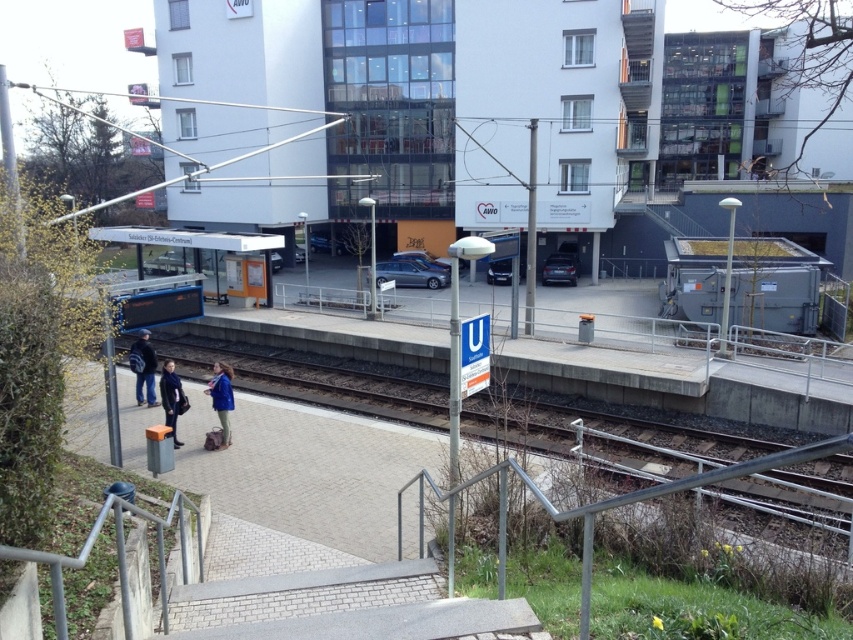
How far apart are blue fabric coat at center and dark blue leather jacket at lower left?

blue fabric coat at center is 26.24 inches away from dark blue leather jacket at lower left.

I want to click on blue fabric coat at center, so click(221, 397).

This screenshot has height=640, width=853. I want to click on blue fabric coat at center, so (x=221, y=397).

Who is shorter, dark blue jacket at center or blue fabric coat at center?

blue fabric coat at center

Can you confirm if dark blue jacket at center is positioned below blue fabric coat at center?

Incorrect, dark blue jacket at center is not positioned below blue fabric coat at center.

The height and width of the screenshot is (640, 853). What do you see at coordinates (143, 369) in the screenshot?
I see `dark blue jacket at center` at bounding box center [143, 369].

Locate an element on the screen. This screenshot has width=853, height=640. dark blue jacket at center is located at coordinates (143, 369).

Who is shorter, dark blue jacket at center or dark blue leather jacket at lower left?

dark blue leather jacket at lower left

Between point (136, 372) and point (163, 380), which one is positioned in front?

Positioned in front is point (163, 380).

Find the location of a particular element. Image resolution: width=853 pixels, height=640 pixels. dark blue jacket at center is located at coordinates coord(143,369).